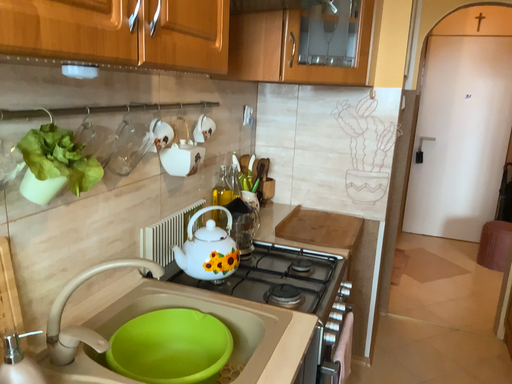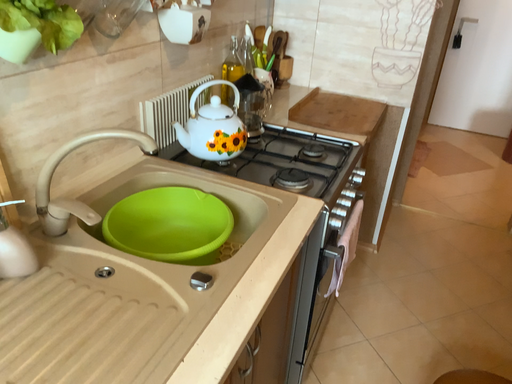
Question: How did the camera likely rotate when shooting the video?

Choices:
 (A) rotated upward
 (B) rotated downward

Answer: (B)